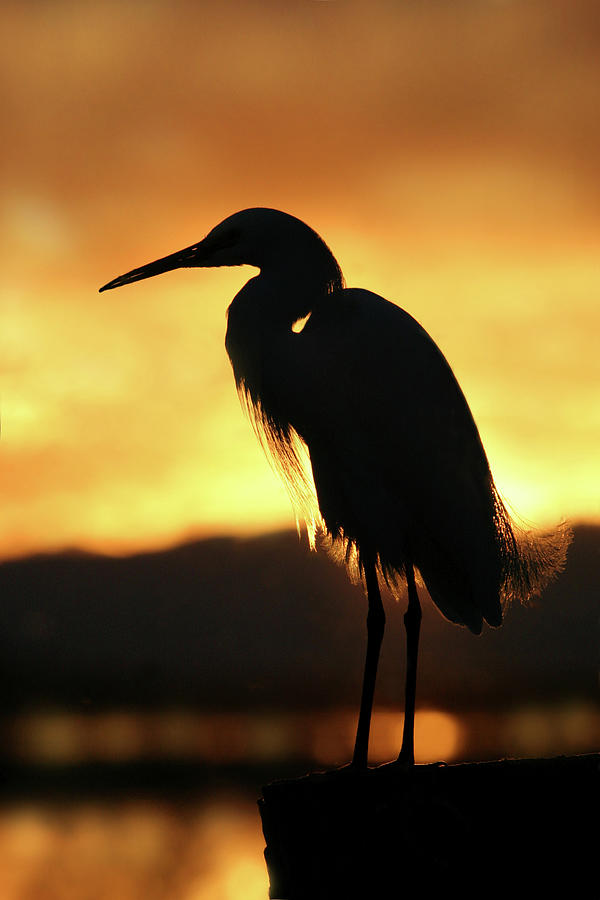
This screenshot has height=900, width=600. What are the coordinates of `black ledge` in the screenshot? It's located at (409, 844).